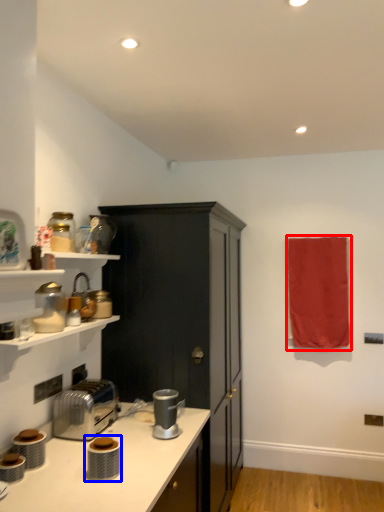
Question: Which point is closer to the camera, beach towel (highlighted by a red box) or appliance (highlighted by a blue box)?

Choices:
 (A) beach towel
 (B) appliance

Answer: (B)